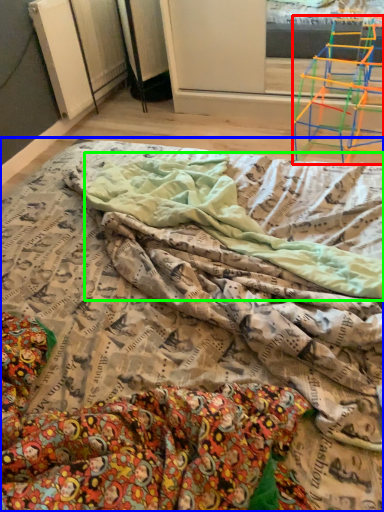
Question: Considering the real-world distances, which object is farthest from furniture (highlighted by a red box)? bed (highlighted by a blue box) or blanket (highlighted by a green box)?

Choices:
 (A) bed
 (B) blanket

Answer: (A)